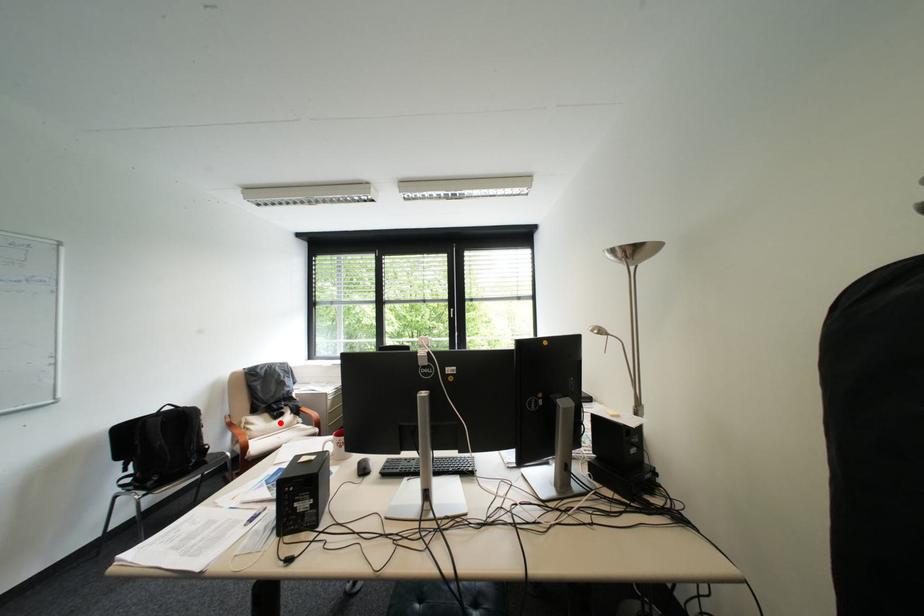
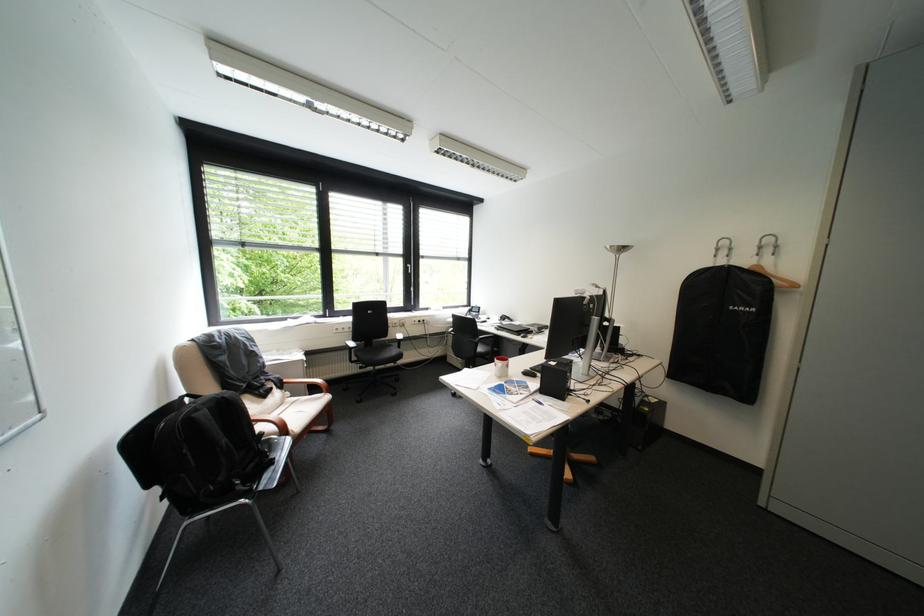
Question: I am providing you with two images of the same scene from different viewpoints. A red point is shown in image1. For the corresponding object point in image2, is it positioned nearer or farther from the camera?

Choices:
 (A) Nearer
 (B) Farther

Answer: (A)